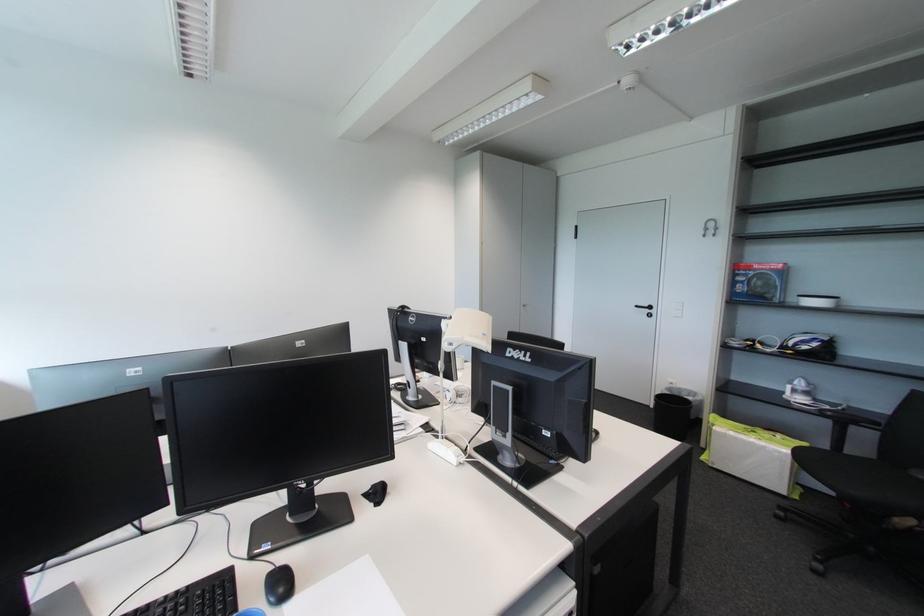
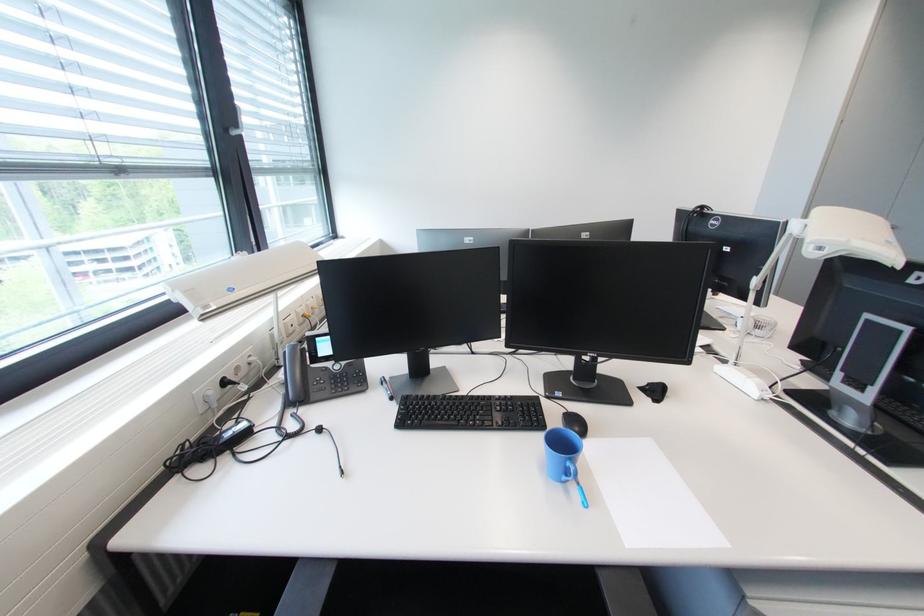
Locate, in the second image, the point that corresponds to [195,589] in the first image.

(517, 398)